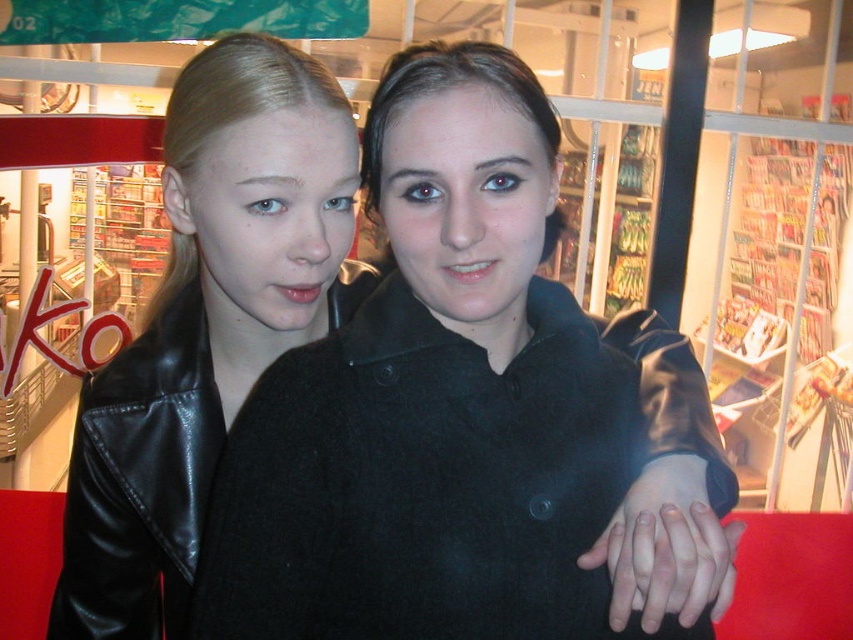
Between black leather jacket at center and black leather jacket at left, which one appears on the right side from the viewer's perspective?

black leather jacket at center is more to the right.

In the scene shown: Who is higher up, black leather jacket at center or black leather jacket at left?

black leather jacket at center

What do you see at coordinates (467, 417) in the screenshot? I see `black leather jacket at center` at bounding box center [467, 417].

Where is `black leather jacket at center`? The width and height of the screenshot is (853, 640). black leather jacket at center is located at coordinates (467, 417).